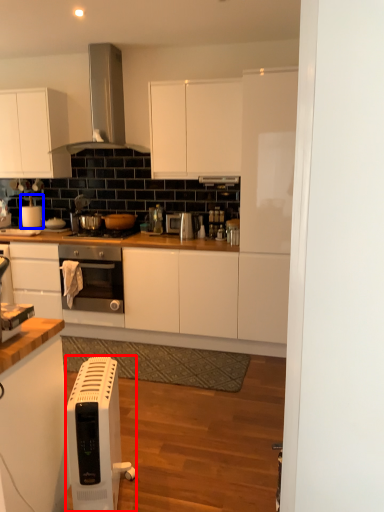
Question: Which point is further to the camera, home appliance (highlighted by a red box) or appliance (highlighted by a blue box)?

Choices:
 (A) home appliance
 (B) appliance

Answer: (B)